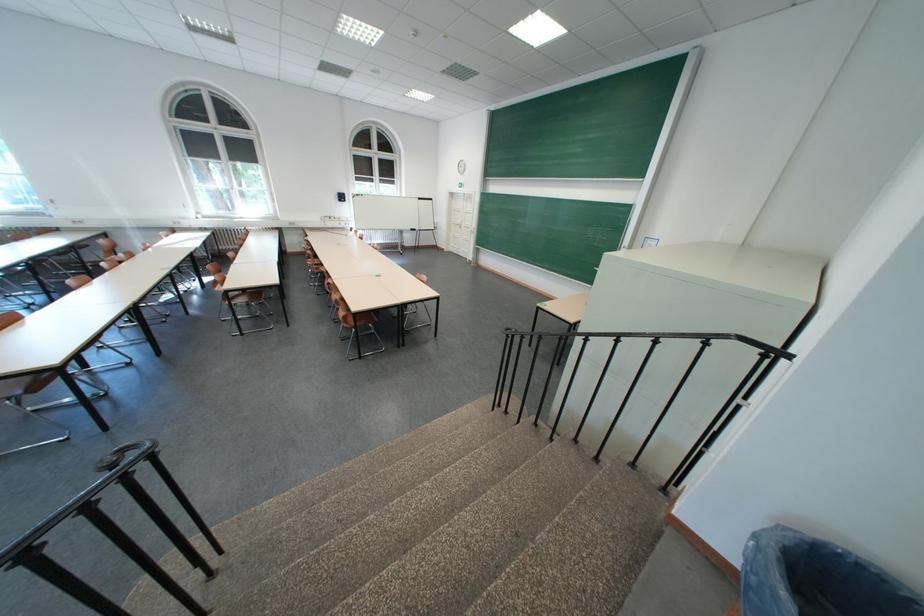
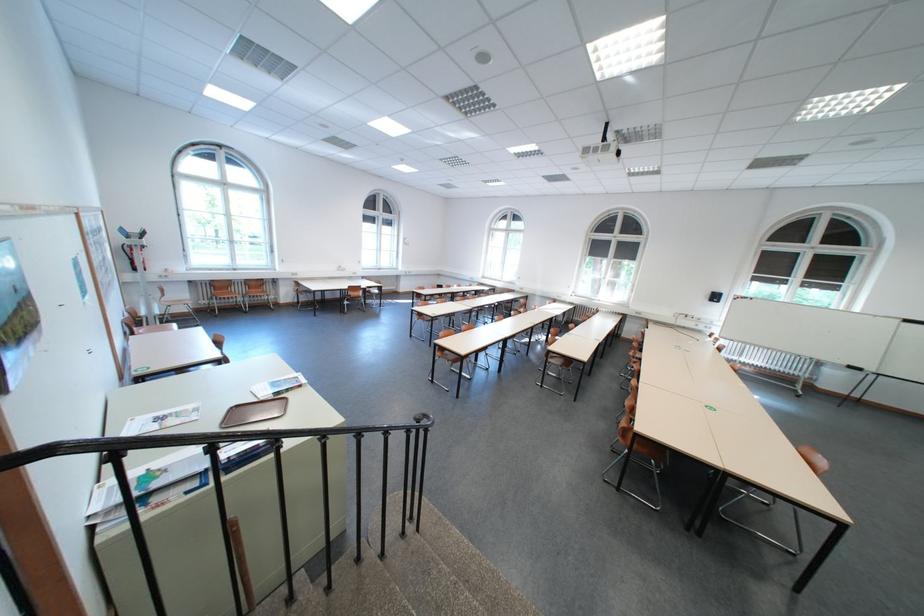
The point at [368,326] is marked in the first image. Where is the corresponding point in the second image?

(643, 445)